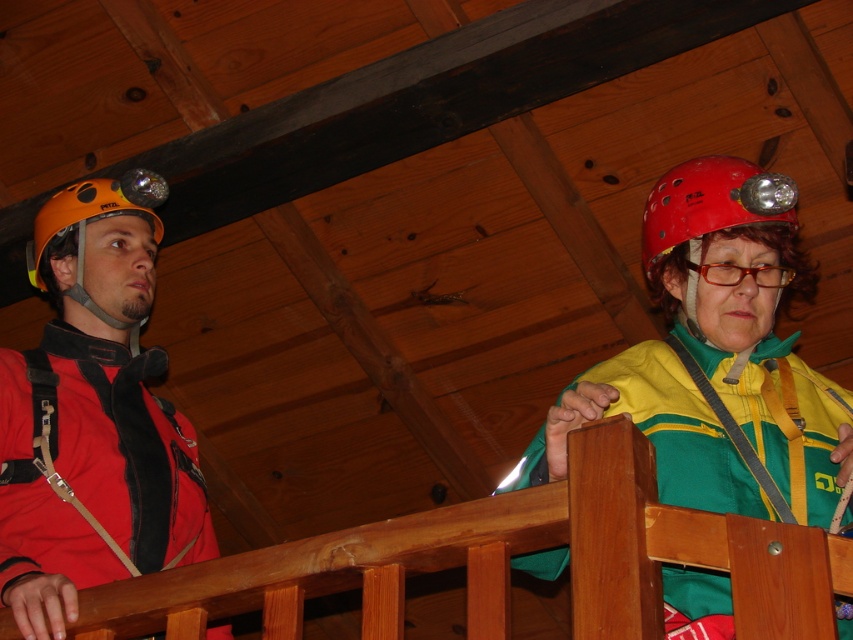
Question: Which of the following is the farthest from the observer?

Choices:
 (A) translucent orange glasses at upper right
 (B) red matte helmet at upper right

Answer: (B)

Question: Which of the following is the closest to the observer?

Choices:
 (A) (740, 452)
 (B) (743, 273)

Answer: (A)

Question: Where is red matte helmet at upper right located in relation to orange matte helmet at left in the image?

Choices:
 (A) above
 (B) below

Answer: (A)

Question: Which point is closer to the camera?

Choices:
 (A) (733, 220)
 (B) (79, 538)
 (C) (798, 396)
 (D) (782, 268)

Answer: (A)

Question: Does red matte helmet at upper right have a lesser width compared to orange matte helmet at left?

Choices:
 (A) yes
 (B) no

Answer: (A)

Question: In this image, where is matte orange helmet at left located relative to translucent orange glasses at upper right?

Choices:
 (A) left
 (B) right

Answer: (A)